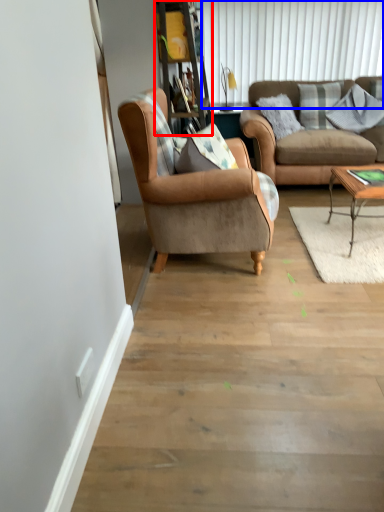
Question: Which object appears farthest to the camera in this image, bookshelf (highlighted by a red box) or shutter (highlighted by a blue box)?

Choices:
 (A) bookshelf
 (B) shutter

Answer: (B)